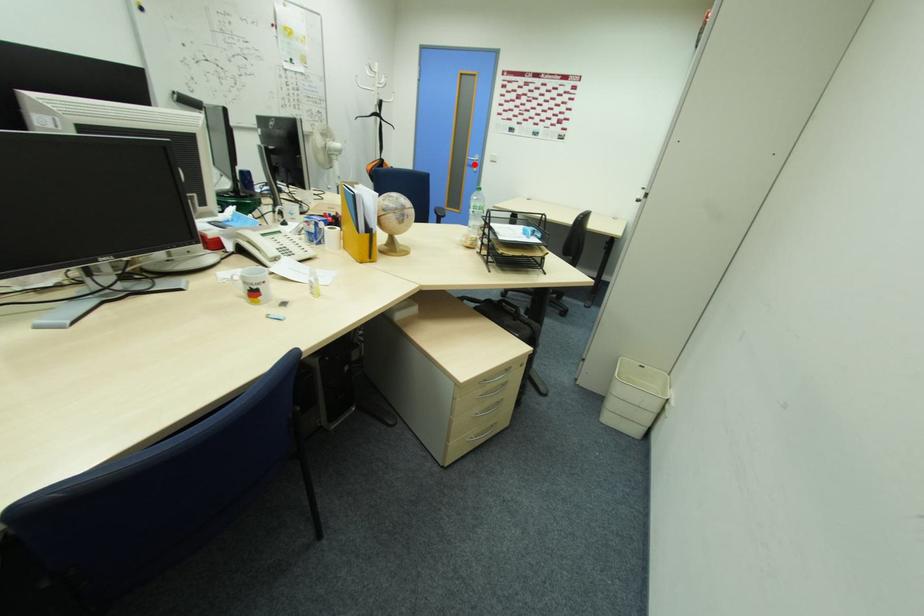
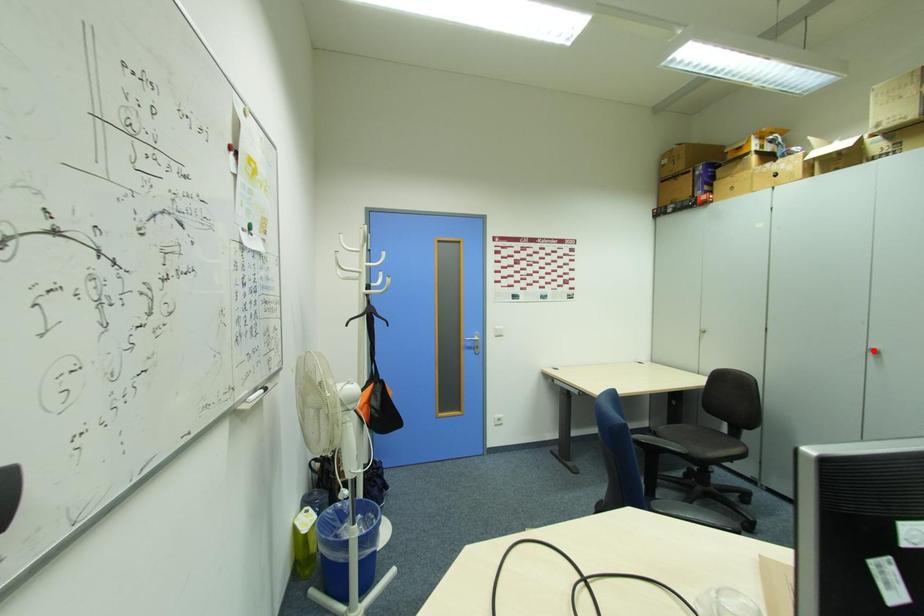
I am providing you with two images of the same scene from different viewpoints. A red point is marked on the first image and another point is marked on the second image. Is the marked point in image1 the same physical position as the marked point in image2?

No